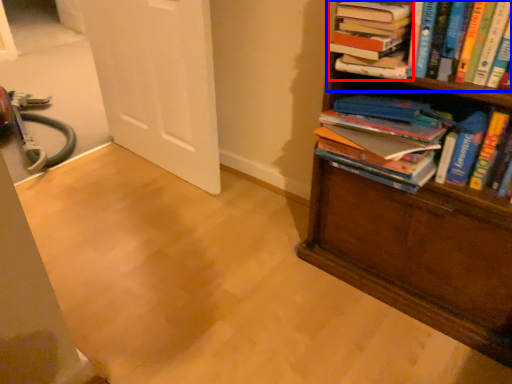
Question: Which point is further to the camera, book (highlighted by a red box) or book (highlighted by a blue box)?

Choices:
 (A) book
 (B) book

Answer: (A)